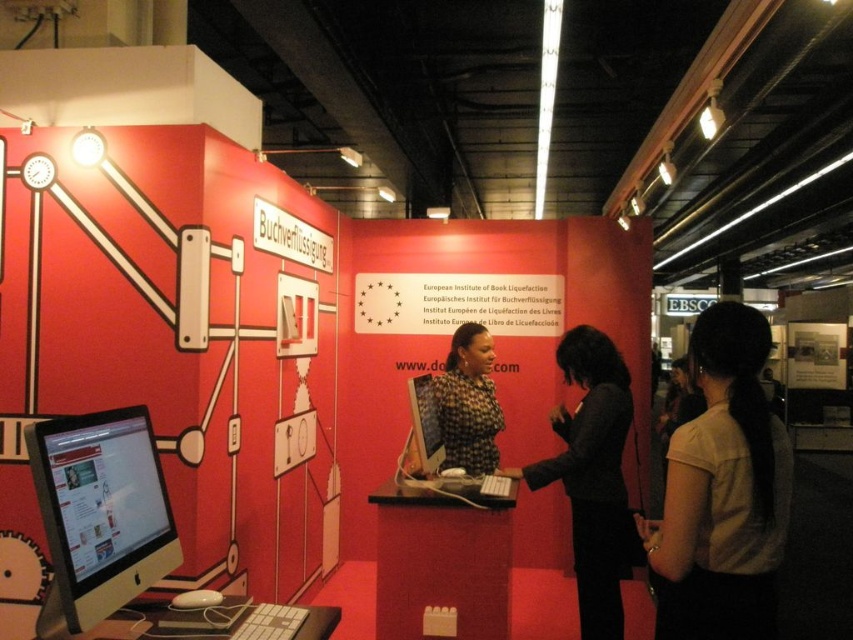
You are a fashion designer observing the exhibition booth and notice two garments displayed nearby. The white fabric shirt at right and the matte black dress at center. Which garment is taller?

The white fabric shirt at right has a greater height compared to the matte black dress at center, so the white fabric shirt at right is taller.

You are at an exhibition and want to take a photo of both the dark brown leather jacket at center and the matte black dress at center. Which one should you focus on first to ensure both are in clear view?

You should focus on the dark brown leather jacket at center first since it is closer to the viewer than the matte black dress at center. By focusing on the closer object, the dress will also be in focus due to the depth of field.

You are a fashion designer who wants to showcase a dress on a monitor. The matte black dress at center and the matte black monitor at center are both in the exhibition. Can you place the dress on the monitor without overlapping?

The matte black dress at center is 8.03 inches away from the matte black monitor at center. Since they are separate objects with space between them, you can place the dress on the monitor without overlapping.